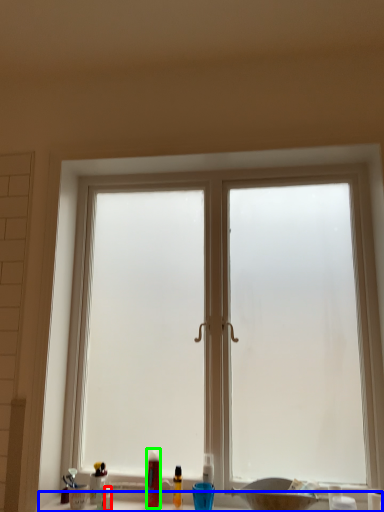
Question: Which object is the closest to the toiletry (highlighted by a red box)? Choose among these: counter top (highlighted by a blue box) or toiletry (highlighted by a green box).

Choices:
 (A) counter top
 (B) toiletry

Answer: (A)